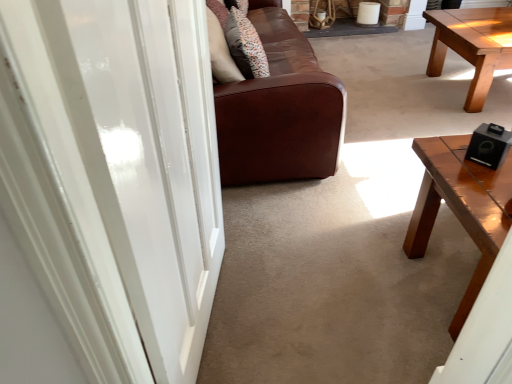
Question: In terms of width, does patterned fabric pillow at center look wider or thinner when compared to black matte speaker at right?

Choices:
 (A) thin
 (B) wide

Answer: (B)

Question: In terms of height, does patterned fabric pillow at center look taller or shorter compared to black matte speaker at right?

Choices:
 (A) short
 (B) tall

Answer: (B)

Question: Estimate the real-world distances between objects in this image. Which object is closer to the brown leather couch at center?

Choices:
 (A) shiny brown wood coffee table at right
 (B) white glossy door at center
 (C) black matte speaker at right
 (D) patterned fabric pillow at center

Answer: (D)

Question: Which object is the closest to the patterned fabric pillow at center?

Choices:
 (A) white glossy door at center
 (B) black matte speaker at right
 (C) brown leather couch at center
 (D) shiny brown wood coffee table at right

Answer: (C)